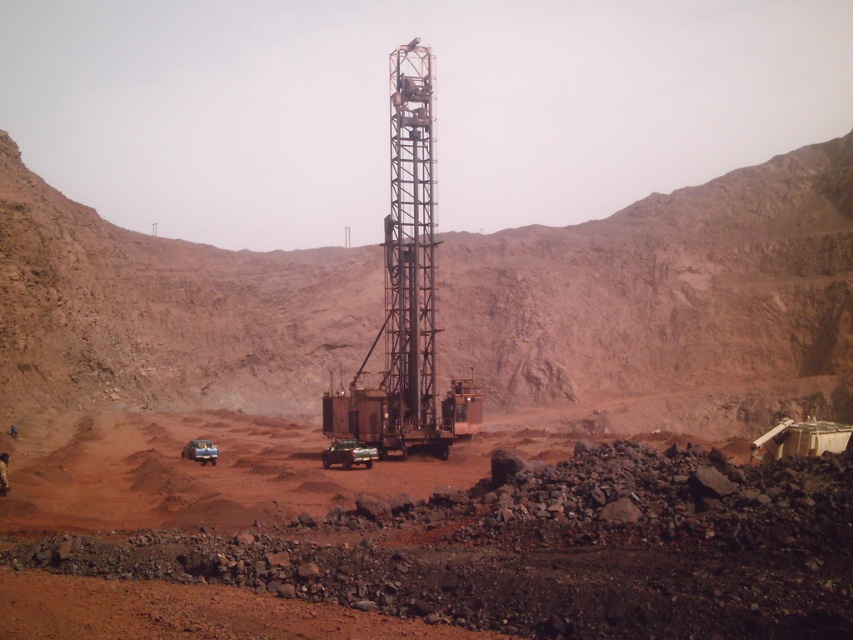
How much distance is there between rusty metal drilling rig at center and metallic silver truck at center?

They are 53.93 feet apart.

Consider the image. Who is taller, rusty metal drilling rig at center or metallic silver truck at center?

With more height is rusty metal drilling rig at center.

You are a GUI agent. You are given a task and a screenshot of the screen. Output one action in this format:
    pyautogui.click(x=<x>, y=<y>)
    Task: Click on the rusty metal drilling rig at center
    
    Given the screenshot: What is the action you would take?
    pyautogui.click(x=405, y=291)

Is rustic metal drilling rig at center further to the viewer compared to rusty metal drilling rig at center?

Yes, rustic metal drilling rig at center is behind rusty metal drilling rig at center.

Does point (660, 246) come closer to viewer compared to point (413, 419)?

That is False.

Which is in front, point (722, 292) or point (328, 436)?

Point (328, 436) is in front.

Identify the location of rustic metal drilling rig at center. click(x=666, y=298).

Who is positioned more to the left, metallic silver truck at center or metallic silver truck at lower left?

Positioned to the left is metallic silver truck at lower left.

Who is more forward, (349, 460) or (215, 460)?

Point (349, 460) is in front.

Where is `metallic silver truck at center`? metallic silver truck at center is located at coordinates (347, 452).